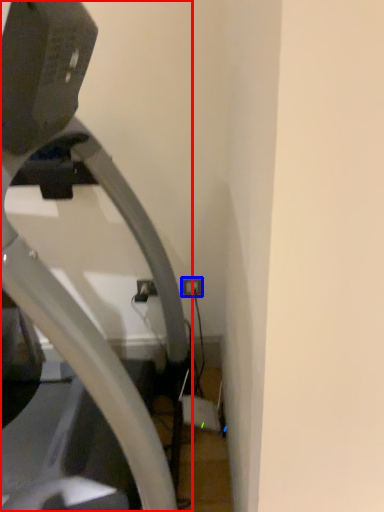
Question: Among these objects, which one is farthest to the camera, treadmill (highlighted by a red box) or electric outlet (highlighted by a blue box)?

Choices:
 (A) treadmill
 (B) electric outlet

Answer: (B)